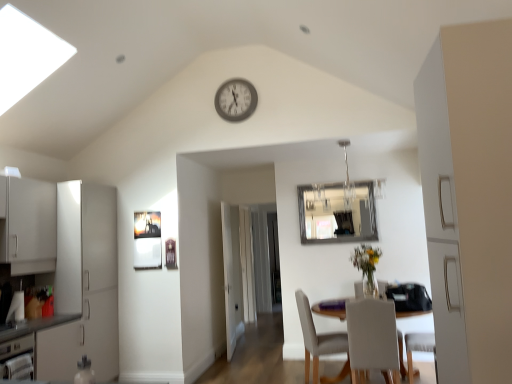
What is the approximate width of white fabric chair at lower center, acting as the first chair starting from the front?

It is 21.52 inches.

The image size is (512, 384). What do you see at coordinates (372, 337) in the screenshot?
I see `white fabric chair at lower center, acting as the second chair starting from the back` at bounding box center [372, 337].

Describe the element at coordinates (320, 343) in the screenshot. I see `white fabric chair at lower right, which is the 2th chair from front to back` at that location.

Measure the distance between white matte cabinet at right and camera.

The distance of white matte cabinet at right from camera is 1.26 meters.

The image size is (512, 384). What do you see at coordinates (236, 100) in the screenshot?
I see `metallic gray clock at upper center` at bounding box center [236, 100].

Image resolution: width=512 pixels, height=384 pixels. Identify the location of white glossy cabinet at left. (84, 285).

What do you see at coordinates (84, 285) in the screenshot? I see `white glossy cabinet at left` at bounding box center [84, 285].

This screenshot has height=384, width=512. Find the location of `transparent glass door at center`. transparent glass door at center is located at coordinates (238, 269).

The height and width of the screenshot is (384, 512). Describe the element at coordinates (337, 214) in the screenshot. I see `clear glass mirror at upper center` at that location.

At what (x,y) coordinates should I click in order to perform the action: click on white wooden door at center. Please return your answer as a coordinate pair (x, y). Looking at the image, I should click on (x=232, y=276).

This screenshot has height=384, width=512. What are the coordinates of `white fabric chair at lower center, acting as the second chair starting from the back` in the screenshot? It's located at (372, 337).

Find the location of a particular element. cabinetry above the metallic silver dishwasher at lower left (from a real-world perspective) is located at coordinates (84, 285).

Is metallic silver dishwasher at lower left completely or partially outside of white glossy cabinet at left?

Yes.

Is metallic silver dishwasher at lower left facing away from white glossy cabinet at left?

No, metallic silver dishwasher at lower left is not facing away from white glossy cabinet at left.

Are metallic silver dishwasher at lower left and white glossy cabinet at left located far from each other?

metallic silver dishwasher at lower left is near white glossy cabinet at left, not far away.

Which object is positioned more to the right, metallic gray clock at upper center or metallic silver dishwasher at lower left?

metallic gray clock at upper center is more to the right.

In the image, is metallic gray clock at upper center positioned in front of or behind metallic silver dishwasher at lower left?

metallic gray clock at upper center is behind metallic silver dishwasher at lower left.

Is metallic gray clock at upper center positioned beyond the bounds of metallic silver dishwasher at lower left?

Yes, metallic gray clock at upper center is located beyond the bounds of metallic silver dishwasher at lower left.

Considering the relative sizes of metallic gray clock at upper center and metallic silver dishwasher at lower left in the image provided, is metallic gray clock at upper center wider than metallic silver dishwasher at lower left?

Incorrect, the width of metallic gray clock at upper center does not surpass that of metallic silver dishwasher at lower left.

Looking at this image, from a real-world perspective, is transparent glass door at center above or below clear glass mirror at upper center?

transparent glass door at center is situated lower than clear glass mirror at upper center in the real world.

Is transparent glass door at center wider than clear glass mirror at upper center?

Correct, the width of transparent glass door at center exceeds that of clear glass mirror at upper center.

How many degrees apart are the facing directions of transparent glass door at center and clear glass mirror at upper center?

0.00022 degrees separate the facing orientations of transparent glass door at center and clear glass mirror at upper center.

Which of these two, transparent glass door at center or clear glass mirror at upper center, is bigger?

transparent glass door at center is bigger.

Between point (426, 220) and point (104, 259), which one is positioned behind?

The point (104, 259) is more distant.

Who is taller, white matte cabinet at right or white glossy cabinet at left?

white glossy cabinet at left.

Between white matte cabinet at right and white glossy cabinet at left, which one has smaller width?

white matte cabinet at right.

Does white matte cabinet at right turn towards white glossy cabinet at left?

No, white matte cabinet at right is not oriented towards white glossy cabinet at left.

I want to click on door that appears above the white fabric chair at lower center, acting as the first chair starting from the front (from a real-world perspective), so click(x=232, y=276).

Who is smaller, white wooden door at center or white fabric chair at lower center, acting as the first chair starting from the front?

With smaller size is white fabric chair at lower center, acting as the first chair starting from the front.

Does white wooden door at center have a lesser height compared to white fabric chair at lower center, acting as the first chair starting from the front?

Incorrect, the height of white wooden door at center does not fall short of that of white fabric chair at lower center, acting as the first chair starting from the front.

Is point (223, 231) behind point (383, 360)?

Yes, point (223, 231) is farther from viewer.

Who is shorter, white wooden door at center or metallic silver dishwasher at lower left?

metallic silver dishwasher at lower left is shorter.

Could metallic silver dishwasher at lower left be considered to be inside white wooden door at center?

No, metallic silver dishwasher at lower left is not inside white wooden door at center.

From the image's perspective, is white wooden door at center over metallic silver dishwasher at lower left?

Yes.

From a real-world perspective, is white wooden door at center over metallic silver dishwasher at lower left?

Indeed, from a real-world perspective, white wooden door at center stands above metallic silver dishwasher at lower left.

From their relative heights in the image, would you say white fabric chair at lower right, the first chair in the back-to-front sequence, is taller or shorter than clear glass mirror at upper center?

white fabric chair at lower right, the first chair in the back-to-front sequence, is taller than clear glass mirror at upper center.

Who is bigger, white fabric chair at lower right, the first chair in the back-to-front sequence, or clear glass mirror at upper center?

white fabric chair at lower right, the first chair in the back-to-front sequence.

How far apart are white fabric chair at lower right, which is the 2th chair from front to back, and clear glass mirror at upper center?

4.65 feet.

From a real-world perspective, relative to clear glass mirror at upper center, is white fabric chair at lower right, the first chair in the back-to-front sequence, vertically above or below?

white fabric chair at lower right, the first chair in the back-to-front sequence, is below clear glass mirror at upper center.

Image resolution: width=512 pixels, height=384 pixels. I want to click on dish washer on the right of the white glossy cabinet at left, so click(x=17, y=358).

The image size is (512, 384). In order to click on clock above the metallic silver dishwasher at lower left (from a real-world perspective) in this screenshot , I will do `click(236, 100)`.

When comparing their distances from white wooden door at center, does metallic gray clock at upper center or white fabric chair at lower right, the first chair in the back-to-front sequence, seem further?

Among the two, metallic gray clock at upper center is located further to white wooden door at center.

From the image, which object appears to be nearer to clear glass mirror at upper center, white matte cabinet at right or white glossy cabinet at left?

white glossy cabinet at left is positioned closer to the anchor clear glass mirror at upper center.

Considering their positions, is white glossy cabinet at left positioned closer to white wooden door at center than metallic silver dishwasher at lower left?

The object closer to white wooden door at center is white glossy cabinet at left.

Estimate the real-world distances between objects in this image. Which object is closer to white fabric chair at lower center, acting as the first chair starting from the front, clear glass mirror at upper center or metallic gray clock at upper center?

clear glass mirror at upper center.

Based on their spatial positions, is transparent glass door at center or clear glass mirror at upper center closer to white matte cabinet at right?

Based on the image, clear glass mirror at upper center appears to be nearer to white matte cabinet at right.

Based on their spatial positions, is white fabric chair at lower right, the first chair in the back-to-front sequence, or clear glass mirror at upper center further from metallic gray clock at upper center?

white fabric chair at lower right, the first chair in the back-to-front sequence, is further to metallic gray clock at upper center.

When comparing their distances from metallic gray clock at upper center, does clear glass mirror at upper center or white wooden door at center seem closer?

Among the two, clear glass mirror at upper center is located nearer to metallic gray clock at upper center.

From the image, which object appears to be farther from white fabric chair at lower right, which is the 2th chair from front to back, transparent glass door at center or white wooden door at center?

transparent glass door at center lies further to white fabric chair at lower right, which is the 2th chair from front to back, than the other object.

Locate an element on the screen. This screenshot has width=512, height=384. window between white matte cabinet at right and transparent glass door at center in the front-back direction is located at coordinates (337, 214).

I want to click on window between metallic gray clock at upper center and white fabric chair at lower center, acting as the second chair starting from the back, vertically, so click(x=337, y=214).

Identify the location of door situated between white glossy cabinet at left and white fabric chair at lower right, the first chair in the back-to-front sequence, from left to right. This screenshot has height=384, width=512. (232, 276).

The width and height of the screenshot is (512, 384). Identify the location of window between white matte cabinet at right and white wooden door at center along the z-axis. (337, 214).